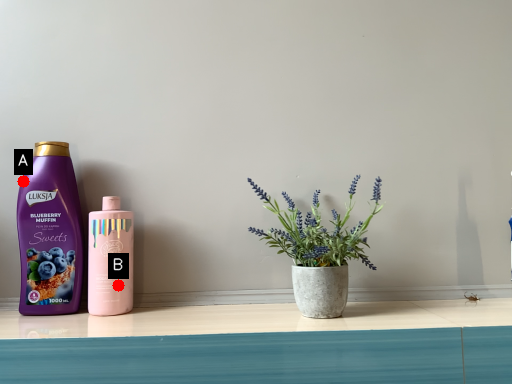
Question: Two points are circled on the image, labeled by A and B beside each circle. Which point is closer to the camera?

Choices:
 (A) A is closer
 (B) B is closer

Answer: (B)